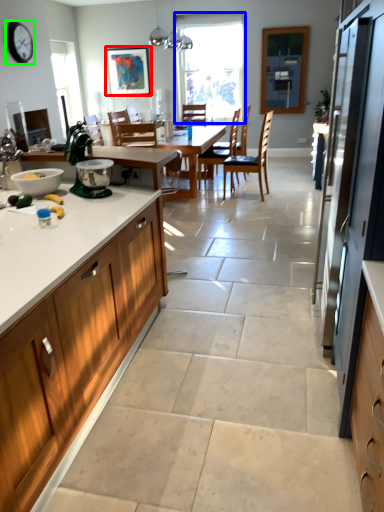
Question: Considering the real-world distances, which object is closest to picture frame (highlighted by a red box)? window (highlighted by a blue box) or clock (highlighted by a green box).

Choices:
 (A) window
 (B) clock

Answer: (A)